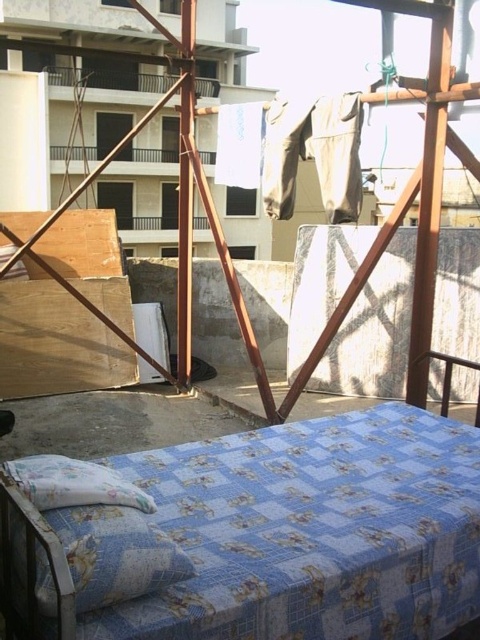
Question: Is blue printed fabric bed at center smaller than fluffy white pillow at lower left?

Choices:
 (A) yes
 (B) no

Answer: (B)

Question: Does blue printed fabric bed at center have a lesser width compared to fluffy white pillow at lower left?

Choices:
 (A) no
 (B) yes

Answer: (A)

Question: Can you confirm if blue printed fabric bed at center is wider than fluffy white pillow at lower left?

Choices:
 (A) yes
 (B) no

Answer: (A)

Question: Which object is closer to the camera taking this photo?

Choices:
 (A) blue printed fabric bed at center
 (B) fluffy white pillow at lower left

Answer: (A)